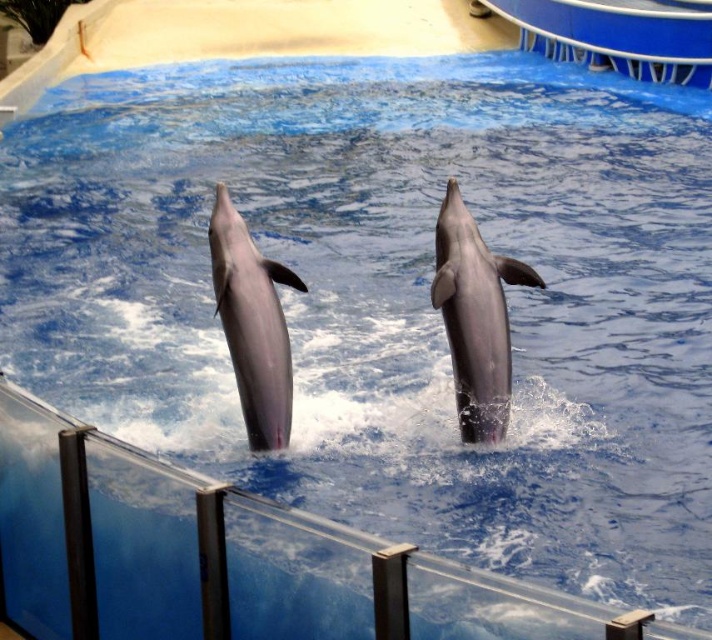
Can you confirm if gray smooth dolphin at center is wider than pink smooth dolphin at center?

Indeed, gray smooth dolphin at center has a greater width compared to pink smooth dolphin at center.

Measure the distance between point (501, 406) and camera.

Point (501, 406) is 26.31 feet away from camera.

You are a GUI agent. You are given a task and a screenshot of the screen. Output one action in this format:
    pyautogui.click(x=<x>, y=<y>)
    Task: Click on the gray smooth dolphin at center
    
    Given the screenshot: What is the action you would take?
    coord(476,317)